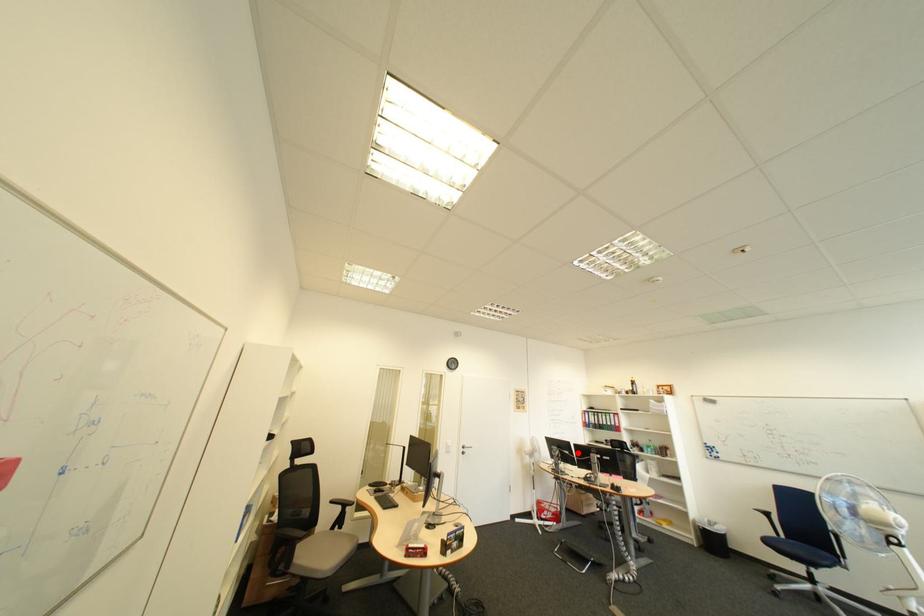
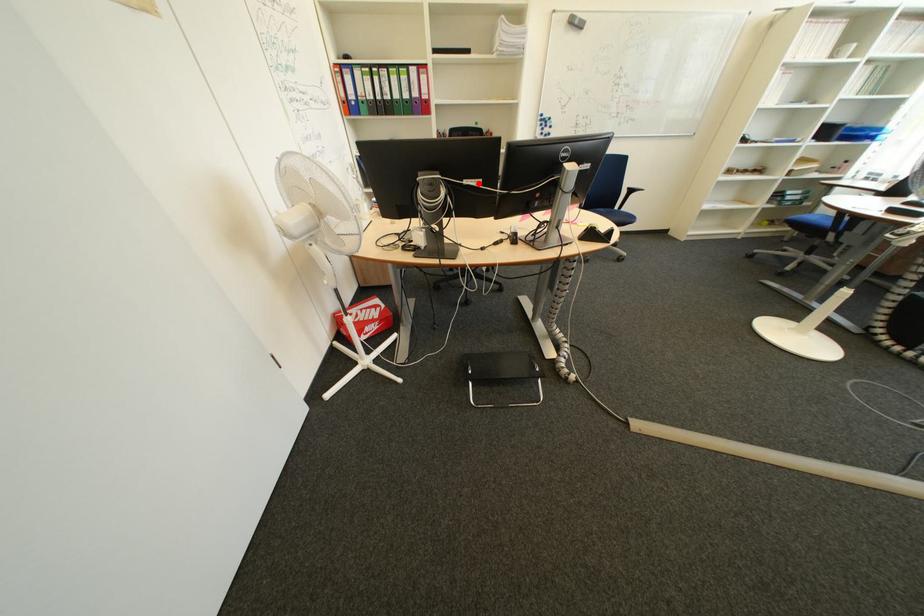
I am providing you with two images of the same scene from different viewpoints. A red point is marked on the first image and another point is marked on the second image. Is the marked point in image1 the same physical position as the marked point in image2?

Yes